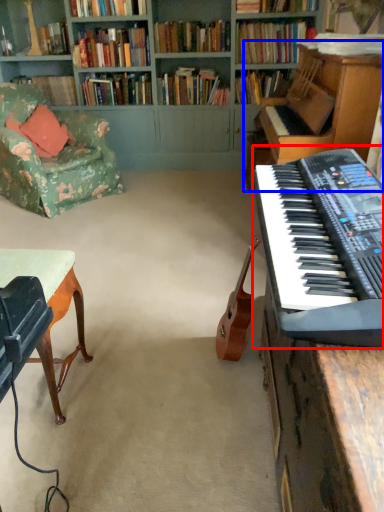
Question: Which of the following is the closest to the observer, musical keyboard (highlighted by a red box) or piano (highlighted by a blue box)?

Choices:
 (A) musical keyboard
 (B) piano

Answer: (A)